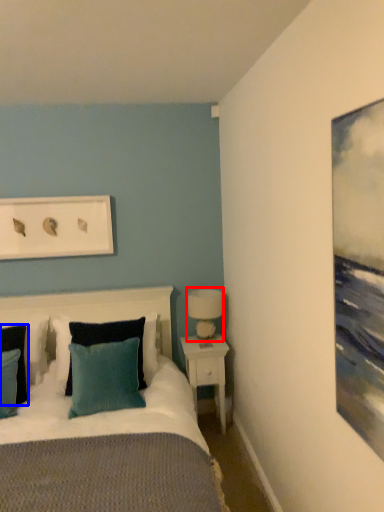
Question: Which of the following is the closest to the observer, table lamp (highlighted by a red box) or pillow (highlighted by a blue box)?

Choices:
 (A) table lamp
 (B) pillow

Answer: (B)